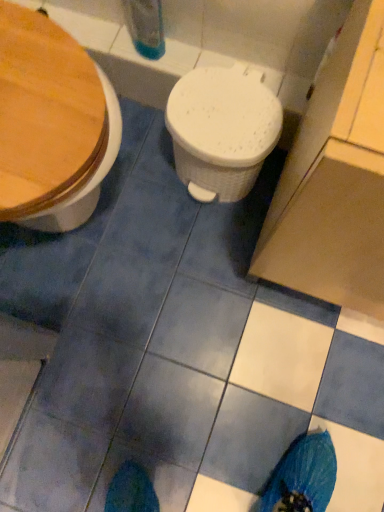
Question: Is wooden at left, positioned as the 1th toilet in left-to-right order, closer to the viewer compared to white textured plastic at center, placed as the first toilet when sorted from right to left?

Choices:
 (A) yes
 (B) no

Answer: (A)

Question: Is wooden at left, positioned as the 1th toilet in left-to-right order, not within white textured plastic at center, placed as the first toilet when sorted from right to left?

Choices:
 (A) yes
 (B) no

Answer: (A)

Question: Is wooden at left, which appears as the second toilet when viewed from the right, thinner than white textured plastic at center, placed as the first toilet when sorted from right to left?

Choices:
 (A) yes
 (B) no

Answer: (B)

Question: Would you consider wooden at left, positioned as the 1th toilet in left-to-right order, to be distant from white textured plastic at center, which ranks as the 2th toilet in left-to-right order?

Choices:
 (A) yes
 (B) no

Answer: (B)

Question: Considering the relative sizes of wooden at left, positioned as the 1th toilet in left-to-right order, and white textured plastic at center, which ranks as the 2th toilet in left-to-right order, in the image provided, is wooden at left, positioned as the 1th toilet in left-to-right order, bigger than white textured plastic at center, which ranks as the 2th toilet in left-to-right order,?

Choices:
 (A) yes
 (B) no

Answer: (A)

Question: Can you confirm if wooden at left, which appears as the second toilet when viewed from the right, is wider than white textured plastic at center, placed as the first toilet when sorted from right to left?

Choices:
 (A) yes
 (B) no

Answer: (A)

Question: From the image's perspective, is white textured plastic at center, placed as the first toilet when sorted from right to left, under wooden at left, which appears as the second toilet when viewed from the right?

Choices:
 (A) no
 (B) yes

Answer: (A)

Question: Is white textured plastic at center, placed as the first toilet when sorted from right to left, far away from wooden at left, positioned as the 1th toilet in left-to-right order?

Choices:
 (A) no
 (B) yes

Answer: (A)

Question: Can you confirm if white textured plastic at center, placed as the first toilet when sorted from right to left, is wider than wooden at left, which appears as the second toilet when viewed from the right?

Choices:
 (A) no
 (B) yes

Answer: (A)

Question: Can you confirm if white textured plastic at center, placed as the first toilet when sorted from right to left, is smaller than wooden at left, positioned as the 1th toilet in left-to-right order?

Choices:
 (A) no
 (B) yes

Answer: (B)

Question: Is white textured plastic at center, which ranks as the 2th toilet in left-to-right order, behind wooden at left, which appears as the second toilet when viewed from the right?

Choices:
 (A) yes
 (B) no

Answer: (A)

Question: From the image's perspective, would you say white textured plastic at center, placed as the first toilet when sorted from right to left, is positioned over wooden at left, positioned as the 1th toilet in left-to-right order?

Choices:
 (A) yes
 (B) no

Answer: (A)

Question: From the image's perspective, is wooden at left, which appears as the second toilet when viewed from the right, above or below white textured plastic at center, which ranks as the 2th toilet in left-to-right order?

Choices:
 (A) below
 (B) above

Answer: (A)